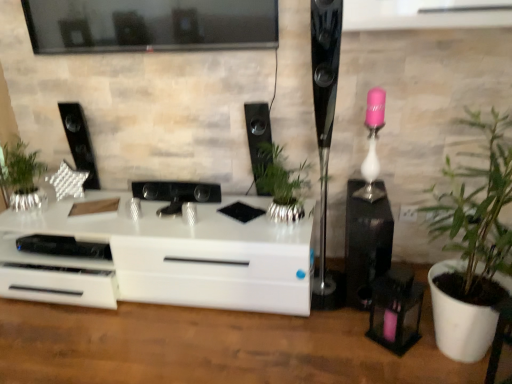
Find the location of a particular element. vacant space underneath silver metallic plant at left, the third houseplant when ordered from right to left (from a real-world perspective) is located at coordinates (29, 214).